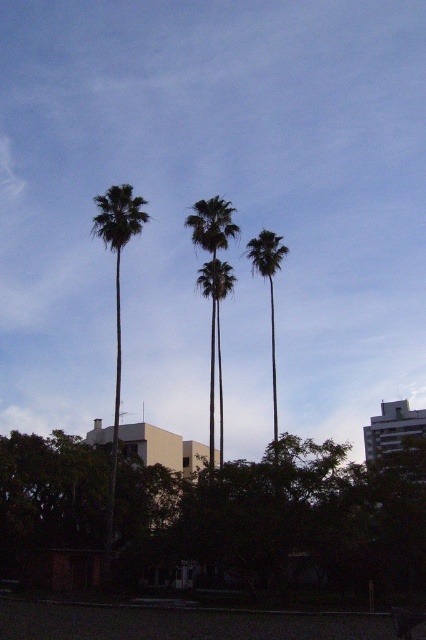
Question: Can you confirm if green leafy tree at lower left is positioned to the left of green leafy palm at center?

Choices:
 (A) yes
 (B) no

Answer: (B)

Question: Among these points, which one is nearest to the camera?

Choices:
 (A) (189, 216)
 (B) (121, 189)

Answer: (B)

Question: Does green leafy tree at lower left have a larger size compared to green leafy palm tree at left?

Choices:
 (A) no
 (B) yes

Answer: (A)

Question: Which point is farther to the camera?

Choices:
 (A) green leafy palm tree at left
 (B) green leafy palm tree at center
 (C) green leafy tree at lower left

Answer: (A)

Question: Is green leafy tree at lower left wider than green leafy palm tree at center?

Choices:
 (A) yes
 (B) no

Answer: (A)

Question: Which of the following is the closest to the observer?

Choices:
 (A) (230, 221)
 (B) (112, 513)

Answer: (B)